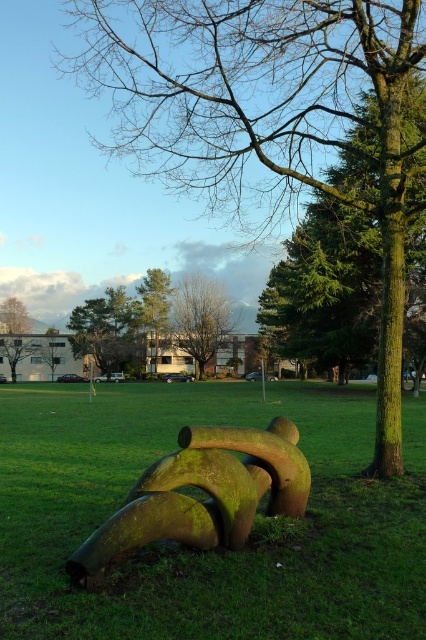
Question: Which point is farther to the camera?

Choices:
 (A) [412, 19]
 (B) [157, 337]
 (C) [224, 529]
 (D) [14, 353]

Answer: (D)

Question: In this image, where is green mossy pipe at center located relative to green textured tree at upper center?

Choices:
 (A) above
 (B) below

Answer: (B)

Question: Can you confirm if green textured tree at center is positioned below green mossy pipe at center?

Choices:
 (A) yes
 (B) no

Answer: (B)

Question: Can you confirm if green mossy pipes at center is positioned above green mossy pipe at center?

Choices:
 (A) yes
 (B) no

Answer: (B)

Question: Which point is closer to the camera taking this photo?

Choices:
 (A) (175, 305)
 (B) (298, 58)
 (C) (170, 285)

Answer: (B)

Question: Based on their relative distances, which object is nearer to the bare branches at center?

Choices:
 (A) green textured tree at upper center
 (B) green mossy tree at center
 (C) green matte tree at center

Answer: (A)